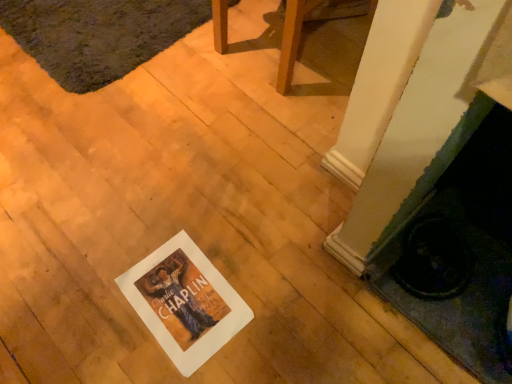
Locate an element on the screen. Image resolution: width=512 pixels, height=384 pixels. free space in front of wooden chair at center is located at coordinates (263, 130).